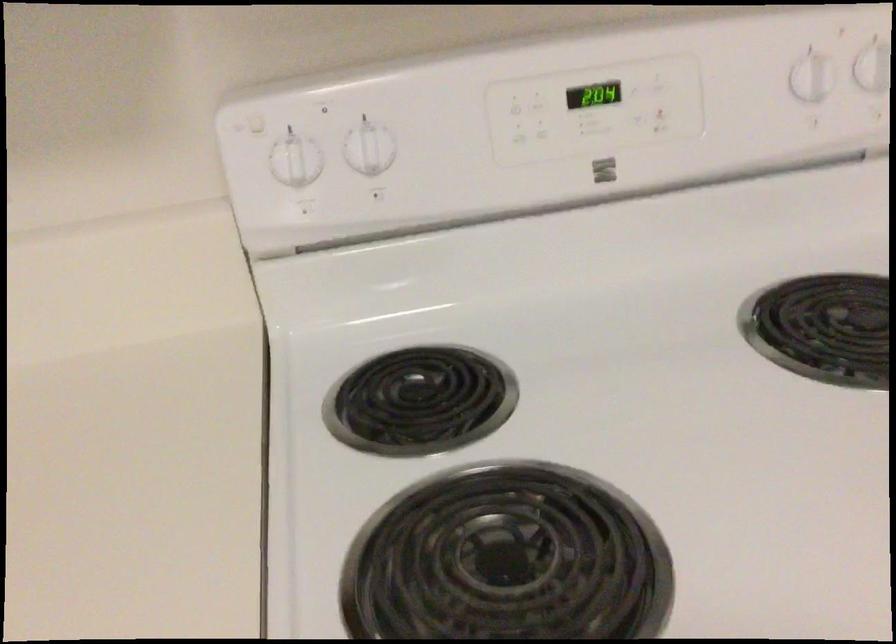
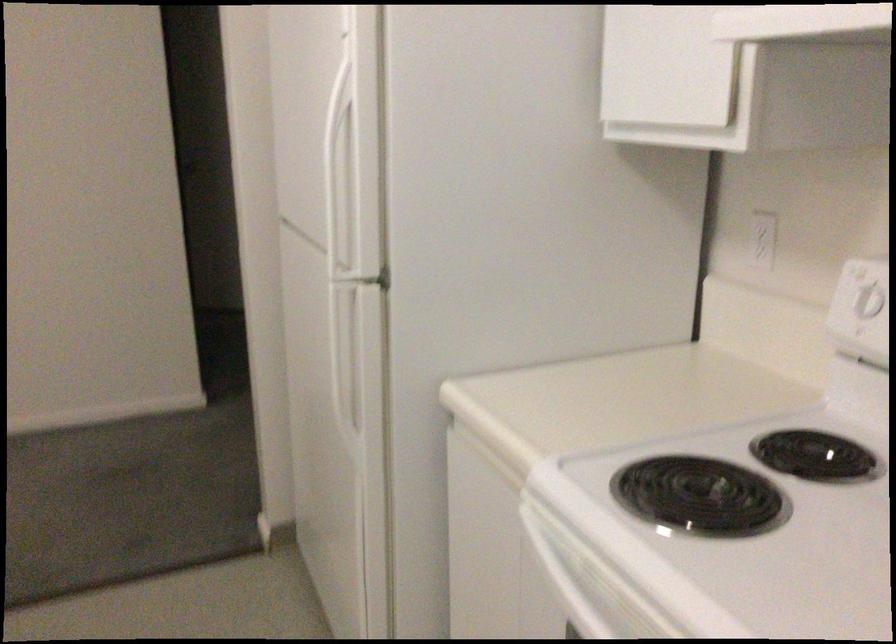
Where in the second image is the point corresponding to pixel 280 156 from the first image?

(864, 289)